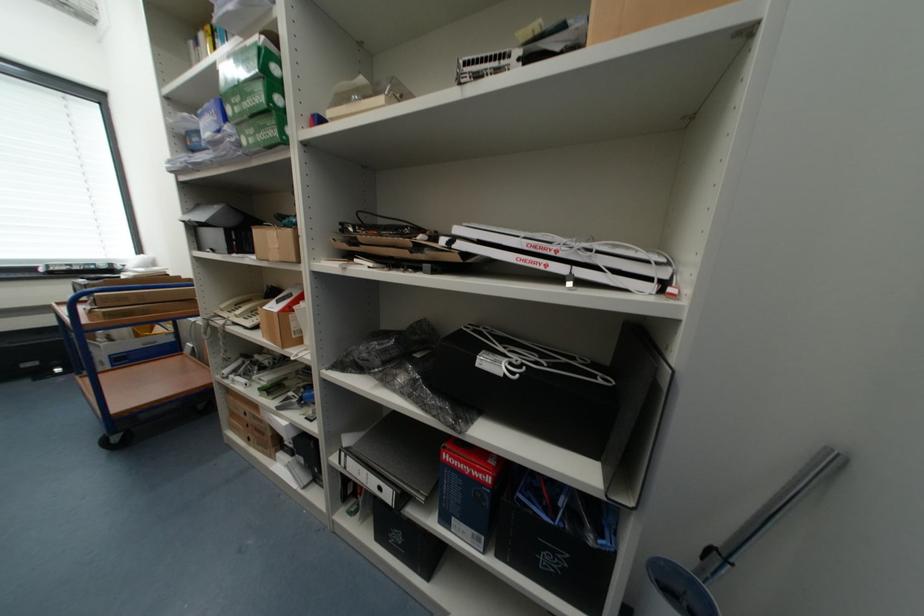
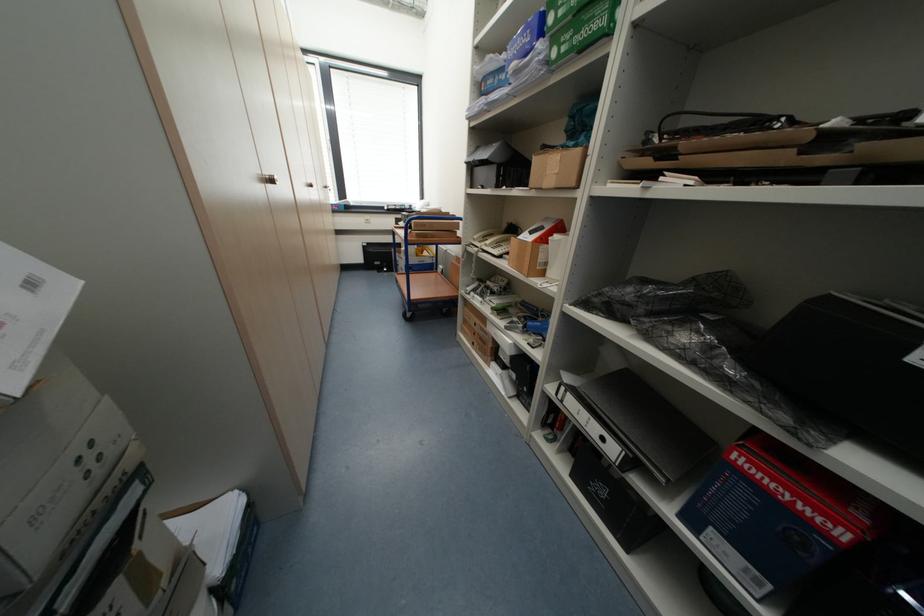
The point at (485, 472) is marked in the first image. Where is the corresponding point in the second image?

(824, 513)